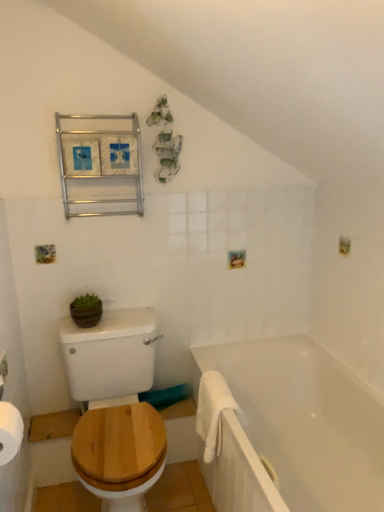
Question: Can we say wooden at left lies outside white fluffy bath towel at lower right?

Choices:
 (A) no
 (B) yes

Answer: (B)

Question: Does wooden at left have a larger size compared to white fluffy bath towel at lower right?

Choices:
 (A) yes
 (B) no

Answer: (A)

Question: Can you confirm if wooden at left is positioned to the right of white fluffy bath towel at lower right?

Choices:
 (A) no
 (B) yes

Answer: (A)

Question: Is wooden at left facing away from white fluffy bath towel at lower right?

Choices:
 (A) yes
 (B) no

Answer: (B)

Question: Is wooden at left smaller than white fluffy bath towel at lower right?

Choices:
 (A) yes
 (B) no

Answer: (B)

Question: In terms of width, does wooden at left look wider or thinner when compared to green matte pot at center?

Choices:
 (A) wide
 (B) thin

Answer: (A)

Question: From a real-world perspective, relative to green matte pot at center, is wooden at left vertically above or below?

Choices:
 (A) below
 (B) above

Answer: (A)

Question: Is wooden at left in front of or behind green matte pot at center in the image?

Choices:
 (A) front
 (B) behind

Answer: (A)

Question: From the image's perspective, is wooden at left located above or below green matte pot at center?

Choices:
 (A) below
 (B) above

Answer: (A)

Question: From a real-world perspective, is green matte pot at center physically located above or below white fluffy bath towel at lower right?

Choices:
 (A) above
 (B) below

Answer: (A)

Question: Based on their positions, is green matte pot at center located to the left or right of white fluffy bath towel at lower right?

Choices:
 (A) left
 (B) right

Answer: (A)

Question: Is green matte pot at center bigger or smaller than white fluffy bath towel at lower right?

Choices:
 (A) big
 (B) small

Answer: (B)

Question: Considering the positions of point (89, 323) and point (208, 373), is point (89, 323) closer or farther from the camera than point (208, 373)?

Choices:
 (A) farther
 (B) closer

Answer: (B)

Question: Is point (142, 212) closer or farther from the camera than point (150, 480)?

Choices:
 (A) farther
 (B) closer

Answer: (A)

Question: Considering the positions of metallic frame at upper left and wooden at left in the image, is metallic frame at upper left wider or thinner than wooden at left?

Choices:
 (A) wide
 (B) thin

Answer: (B)